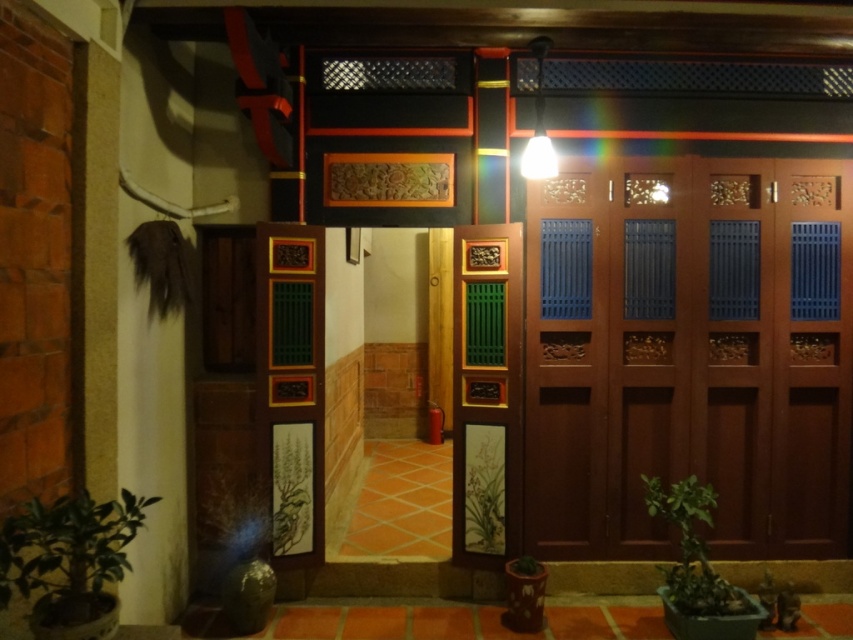
Question: Which point is farther to the camera?

Choices:
 (A) green matte plant at lower left
 (B) green leafy plant at lower right
 (C) wooden carved door at center
 (D) green matte painting at center

Answer: (D)

Question: Is green matte plant at lower left to the right of green matte painting at center from the viewer's perspective?

Choices:
 (A) yes
 (B) no

Answer: (B)

Question: Does wooden carved door at center have a lesser width compared to green leafy plant at lower right?

Choices:
 (A) yes
 (B) no

Answer: (A)

Question: Among these points, which one is nearest to the camera?

Choices:
 (A) (13, 566)
 (B) (688, 506)

Answer: (A)

Question: Can you confirm if mahogany wood door at right is positioned to the left of green leafy plant at lower right?

Choices:
 (A) yes
 (B) no

Answer: (B)

Question: Among these objects, which one is nearest to the camera?

Choices:
 (A) wooden carved door at center
 (B) green matte plant at lower left

Answer: (B)